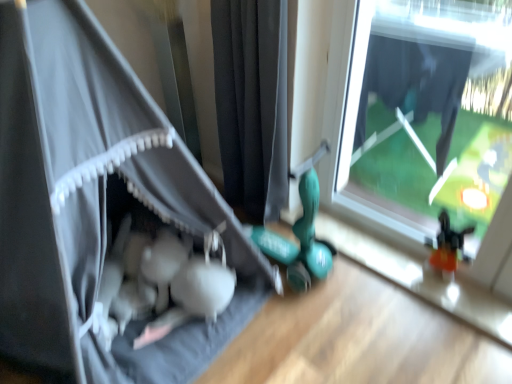
The width and height of the screenshot is (512, 384). In order to click on transparent glass window at center in this screenshot , I will do `click(428, 114)`.

Measure the distance between black fabric curtain at center, which appears as the second curtain when viewed from the left, and camera.

black fabric curtain at center, which appears as the second curtain when viewed from the left, and camera are 4.50 feet apart from each other.

The width and height of the screenshot is (512, 384). Find the location of `matte gray tent at left, acting as the 1th curtain starting from the left`. matte gray tent at left, acting as the 1th curtain starting from the left is located at coordinates (x=90, y=195).

Between matte gray tent at left, acting as the 1th curtain starting from the left, and transparent glass window at center, which one is positioned in front?

matte gray tent at left, acting as the 1th curtain starting from the left, is in front.

Can transparent glass window at center be found inside matte gray tent at left, marked as the 2th curtain in a right-to-left arrangement?

No, matte gray tent at left, marked as the 2th curtain in a right-to-left arrangement, does not contain transparent glass window at center.

Is matte gray tent at left, acting as the 1th curtain starting from the left, facing away from transparent glass window at center?

matte gray tent at left, acting as the 1th curtain starting from the left, does not have its back to transparent glass window at center.

From a real-world perspective, who is located lower, matte gray tent at left, acting as the 1th curtain starting from the left, or transparent glass window at center?

transparent glass window at center is physically lower.

Does transparent glass window at center have a lesser width compared to black fabric curtain at center, which is counted as the 1th curtain, starting from the right?

Correct, the width of transparent glass window at center is less than that of black fabric curtain at center, which is counted as the 1th curtain, starting from the right.

From the picture: From a real-world perspective, is transparent glass window at center positioned above or below black fabric curtain at center, which is counted as the 1th curtain, starting from the right?

transparent glass window at center is situated higher than black fabric curtain at center, which is counted as the 1th curtain, starting from the right, in the real world.

Is transparent glass window at center taller or shorter than black fabric curtain at center, which is counted as the 1th curtain, starting from the right?

transparent glass window at center is shorter than black fabric curtain at center, which is counted as the 1th curtain, starting from the right.

Is black fabric curtain at center, which appears as the second curtain when viewed from the left, at the back of transparent glass window at center?

No, transparent glass window at center is not facing away from black fabric curtain at center, which appears as the second curtain when viewed from the left.

Does matte gray tent at left, acting as the 1th curtain starting from the left, have a greater height compared to black fabric curtain at center, which appears as the second curtain when viewed from the left?

Yes, matte gray tent at left, acting as the 1th curtain starting from the left, is taller than black fabric curtain at center, which appears as the second curtain when viewed from the left.

Is matte gray tent at left, marked as the 2th curtain in a right-to-left arrangement, oriented towards black fabric curtain at center, which appears as the second curtain when viewed from the left?

No, matte gray tent at left, marked as the 2th curtain in a right-to-left arrangement, is not turned towards black fabric curtain at center, which appears as the second curtain when viewed from the left.

From the image's perspective, which one is positioned higher, matte gray tent at left, marked as the 2th curtain in a right-to-left arrangement, or black fabric curtain at center, which is counted as the 1th curtain, starting from the right?

black fabric curtain at center, which is counted as the 1th curtain, starting from the right, from the image's perspective.

Does black fabric curtain at center, which is counted as the 1th curtain, starting from the right, have a larger size compared to matte gray tent at left, acting as the 1th curtain starting from the left?

Actually, black fabric curtain at center, which is counted as the 1th curtain, starting from the right, might be smaller than matte gray tent at left, acting as the 1th curtain starting from the left.

Is black fabric curtain at center, which is counted as the 1th curtain, starting from the right, aimed at matte gray tent at left, acting as the 1th curtain starting from the left?

Yes, black fabric curtain at center, which is counted as the 1th curtain, starting from the right, is facing matte gray tent at left, acting as the 1th curtain starting from the left.

Which is correct: black fabric curtain at center, which appears as the second curtain when viewed from the left, is inside matte gray tent at left, acting as the 1th curtain starting from the left, or outside of it?

black fabric curtain at center, which appears as the second curtain when viewed from the left, cannot be found inside matte gray tent at left, acting as the 1th curtain starting from the left.

Considering their positions, is black fabric curtain at center, which is counted as the 1th curtain, starting from the right, located in front of or behind matte gray tent at left, acting as the 1th curtain starting from the left?

Clearly, black fabric curtain at center, which is counted as the 1th curtain, starting from the right, is behind matte gray tent at left, acting as the 1th curtain starting from the left.

Does point (245, 169) appear closer or farther from the camera than point (389, 91)?

Point (245, 169) is positioned closer to the camera compared to point (389, 91).

Would you say black fabric curtain at center, which appears as the second curtain when viewed from the left, is outside transparent glass window at center?

Yes, black fabric curtain at center, which appears as the second curtain when viewed from the left, is outside of transparent glass window at center.

At what (x,y) coordinates should I click in order to perform the action: click on curtain beneath the transparent glass window at center (from a real-world perspective). Please return your answer as a coordinate pair (x, y). Looking at the image, I should click on (252, 103).

Is transparent glass window at center positioned with its back to matte gray tent at left, acting as the 1th curtain starting from the left?

No, matte gray tent at left, acting as the 1th curtain starting from the left, is not at the back of transparent glass window at center.

Looking at this image, does transparent glass window at center lie in front of matte gray tent at left, marked as the 2th curtain in a right-to-left arrangement?

No, it is behind matte gray tent at left, marked as the 2th curtain in a right-to-left arrangement.

Where is `window located underneath the matte gray tent at left, acting as the 1th curtain starting from the left (from a real-world perspective)`? The width and height of the screenshot is (512, 384). window located underneath the matte gray tent at left, acting as the 1th curtain starting from the left (from a real-world perspective) is located at coordinates (428, 114).

I want to click on window that is under the matte gray tent at left, marked as the 2th curtain in a right-to-left arrangement (from a real-world perspective), so click(x=428, y=114).

Where is `curtain above the transparent glass window at center (from the image's perspective)`? The width and height of the screenshot is (512, 384). curtain above the transparent glass window at center (from the image's perspective) is located at coordinates (252, 103).

When comparing their distances from transparent glass window at center, does matte gray tent at left, acting as the 1th curtain starting from the left, or black fabric curtain at center, which is counted as the 1th curtain, starting from the right, seem closer?

black fabric curtain at center, which is counted as the 1th curtain, starting from the right, is positioned closer to the anchor transparent glass window at center.

From the image, which object appears to be nearer to black fabric curtain at center, which appears as the second curtain when viewed from the left, transparent glass window at center or matte gray tent at left, marked as the 2th curtain in a right-to-left arrangement?

Among the two, matte gray tent at left, marked as the 2th curtain in a right-to-left arrangement, is located nearer to black fabric curtain at center, which appears as the second curtain when viewed from the left.

Based on the photo, estimate the real-world distances between objects in this image. Which object is further from matte gray tent at left, marked as the 2th curtain in a right-to-left arrangement, transparent glass window at center or black fabric curtain at center, which appears as the second curtain when viewed from the left?

transparent glass window at center is further to matte gray tent at left, marked as the 2th curtain in a right-to-left arrangement.

Which object lies further to the anchor point transparent glass window at center, black fabric curtain at center, which appears as the second curtain when viewed from the left, or matte gray tent at left, acting as the 1th curtain starting from the left?

matte gray tent at left, acting as the 1th curtain starting from the left, is positioned further to the anchor transparent glass window at center.

When comparing their distances from matte gray tent at left, marked as the 2th curtain in a right-to-left arrangement, does black fabric curtain at center, which appears as the second curtain when viewed from the left, or transparent glass window at center seem further?

transparent glass window at center lies further to matte gray tent at left, marked as the 2th curtain in a right-to-left arrangement, than the other object.

Which object lies further to the anchor point black fabric curtain at center, which is counted as the 1th curtain, starting from the right, matte gray tent at left, acting as the 1th curtain starting from the left, or transparent glass window at center?

transparent glass window at center is positioned further to the anchor black fabric curtain at center, which is counted as the 1th curtain, starting from the right.

Where is `curtain between matte gray tent at left, marked as the 2th curtain in a right-to-left arrangement, and transparent glass window at center`? curtain between matte gray tent at left, marked as the 2th curtain in a right-to-left arrangement, and transparent glass window at center is located at coordinates (252, 103).